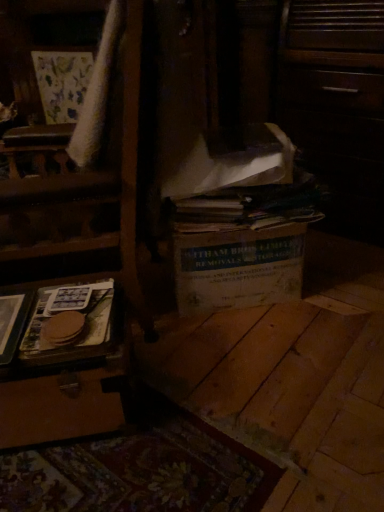
Question: Relative to velvet-like beige armchair at upper left, is white cardboard box at center in front or behind?

Choices:
 (A) behind
 (B) front

Answer: (B)

Question: Is white cardboard box at center to the left or to the right of velvet-like beige armchair at upper left in the image?

Choices:
 (A) left
 (B) right

Answer: (B)

Question: Based on their relative distances, which object is nearer to the brown paper at lower left?

Choices:
 (A) wooden tray at left
 (B) velvet-like beige armchair at upper left
 (C) white cardboard box at center

Answer: (A)

Question: Which object is the closest to the white cardboard box at center?

Choices:
 (A) brown paper at lower left
 (B) velvet-like beige armchair at upper left
 (C) wooden tray at left

Answer: (A)